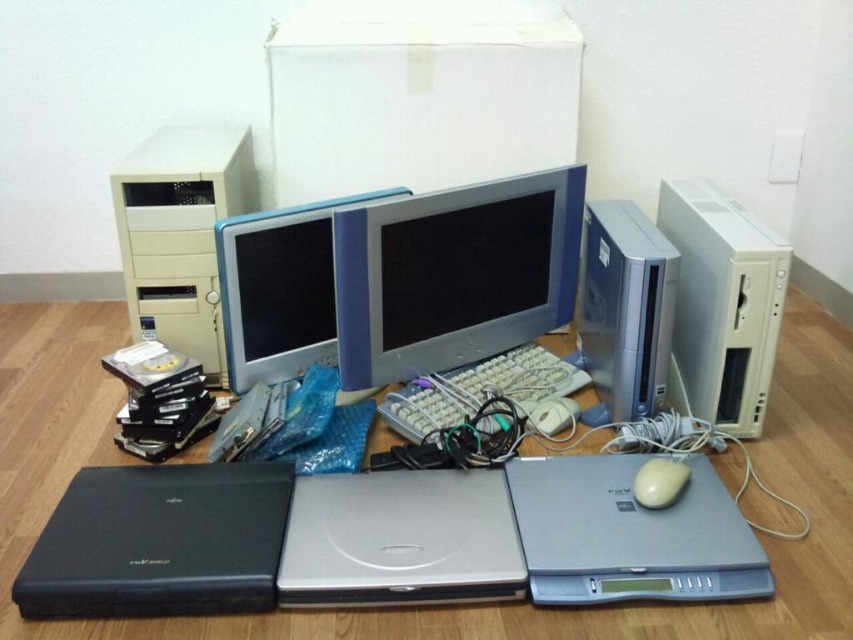
You are organizing a tech exhibition and need to determine the display order for the black matte laptop at lower left and the matte plastic monitor at center based on their sizes. Which one should be placed first if you want to arrange them from smallest to largest?

The black matte laptop at lower left should be placed first because it has a smaller size compared to the matte plastic monitor at center.

You are a technician trying to organize the storage room. You need to place a new CRT monitor between the black matte laptop at lower left and the silver laptop at middle. Can you fit it there?

The distance between the black matte laptop at lower left and the silver laptop at middle is 36.44 inches. The CRT monitor requires at least 32 inches of space. Therefore, it can be placed there.